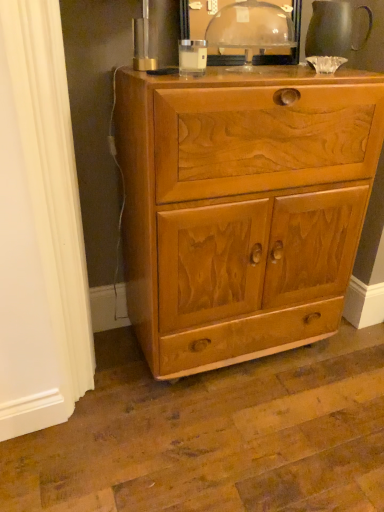
The image size is (384, 512). What do you see at coordinates (241, 211) in the screenshot?
I see `light brown wood cabinet at center` at bounding box center [241, 211].

Where is `matte gray pitcher at upper right`? matte gray pitcher at upper right is located at coordinates (333, 28).

Is light brown wood cabinet at center looking in the opposite direction of transparent plastic dome at upper center?

No, light brown wood cabinet at center is not facing the opposite direction of transparent plastic dome at upper center.

From a real-world perspective, is light brown wood cabinet at center physically located above or below transparent plastic dome at upper center?

light brown wood cabinet at center is below transparent plastic dome at upper center.

Can you see light brown wood cabinet at center touching transparent plastic dome at upper center?

No, light brown wood cabinet at center is not next to transparent plastic dome at upper center.

From a real-world perspective, is matte gray pitcher at upper right on top of transparent plastic dome at upper center?

Correct, in the physical world, matte gray pitcher at upper right is higher than transparent plastic dome at upper center.

From their relative heights in the image, would you say matte gray pitcher at upper right is taller or shorter than transparent plastic dome at upper center?

In the image, matte gray pitcher at upper right appears to be shorter than transparent plastic dome at upper center.

Is matte gray pitcher at upper right in front of or behind transparent plastic dome at upper center in the image?

matte gray pitcher at upper right is positioned farther from the viewer than transparent plastic dome at upper center.

Is matte gray pitcher at upper right at the left side of transparent plastic dome at upper center?

No.

Are transparent plastic dome at upper center and matte gray pitcher at upper right located far from each other?

No.

Considering the relative sizes of transparent plastic dome at upper center and matte gray pitcher at upper right in the image provided, is transparent plastic dome at upper center thinner than matte gray pitcher at upper right?

Incorrect, the width of transparent plastic dome at upper center is not less than that of matte gray pitcher at upper right.

From a real-world perspective, between transparent plastic dome at upper center and matte gray pitcher at upper right, who is vertically lower?

From a 3D spatial view, transparent plastic dome at upper center is below.

Can you tell me how much transparent plastic dome at upper center and matte gray pitcher at upper right differ in facing direction?

The facing directions of transparent plastic dome at upper center and matte gray pitcher at upper right are 2.58 degrees apart.

Can you confirm if matte gray pitcher at upper right is positioned to the right of light brown wood cabinet at center?

Yes, matte gray pitcher at upper right is to the right of light brown wood cabinet at center.

Is matte gray pitcher at upper right oriented towards light brown wood cabinet at center?

No, matte gray pitcher at upper right is not oriented towards light brown wood cabinet at center.

Considering the positions of objects matte gray pitcher at upper right and light brown wood cabinet at center in the image provided, who is behind, matte gray pitcher at upper right or light brown wood cabinet at center?

matte gray pitcher at upper right is behind.

Relative to matte gray pitcher at upper right, is light brown wood cabinet at center in front or behind?

light brown wood cabinet at center is positioned closer to the viewer than matte gray pitcher at upper right.

From a real-world perspective, between light brown wood cabinet at center and matte gray pitcher at upper right, who is vertically higher?

From a 3D spatial view, matte gray pitcher at upper right is above.

How many degrees apart are the facing directions of light brown wood cabinet at center and matte gray pitcher at upper right?

1.82 degrees.

Could you tell me if light brown wood cabinet at center is turned towards matte gray pitcher at upper right?

No, light brown wood cabinet at center is not turned towards matte gray pitcher at upper right.

From the image's perspective, is transparent plastic dome at upper center over light brown wood cabinet at center?

Yes.

Is light brown wood cabinet at center surrounded by transparent plastic dome at upper center?

Actually, light brown wood cabinet at center is outside transparent plastic dome at upper center.

Is transparent plastic dome at upper center aimed at light brown wood cabinet at center?

No, transparent plastic dome at upper center is not facing towards light brown wood cabinet at center.

Can you confirm if transparent plastic dome at upper center is shorter than light brown wood cabinet at center?

Yes, transparent plastic dome at upper center is shorter than light brown wood cabinet at center.

Image resolution: width=384 pixels, height=512 pixels. Identify the location of chest of drawers below the transparent plastic dome at upper center (from a real-world perspective). (241, 211).

Find the location of a particular element. The image size is (384, 512). table lamp that is below the matte gray pitcher at upper right (from the image's perspective) is located at coordinates (253, 34).

Based on their spatial positions, is transparent plastic dome at upper center or light brown wood cabinet at center further from matte gray pitcher at upper right?

The object further to matte gray pitcher at upper right is light brown wood cabinet at center.

In the scene shown: Estimate the real-world distances between objects in this image. Which object is closer to light brown wood cabinet at center, matte gray pitcher at upper right or transparent plastic dome at upper center?

transparent plastic dome at upper center lies closer to light brown wood cabinet at center than the other object.

Considering their positions, is light brown wood cabinet at center positioned further to matte gray pitcher at upper right than transparent plastic dome at upper center?

light brown wood cabinet at center is positioned further to the anchor matte gray pitcher at upper right.

Considering their positions, is matte gray pitcher at upper right positioned closer to transparent plastic dome at upper center than light brown wood cabinet at center?

matte gray pitcher at upper right is positioned closer to the anchor transparent plastic dome at upper center.

In the scene shown: Based on their spatial positions, is light brown wood cabinet at center or matte gray pitcher at upper right further from transparent plastic dome at upper center?

The object further to transparent plastic dome at upper center is light brown wood cabinet at center.

Looking at this image, looking at the image, which one is located further to light brown wood cabinet at center, transparent plastic dome at upper center or matte gray pitcher at upper right?

matte gray pitcher at upper right.

Find the location of a particular element. This screenshot has height=512, width=384. table lamp between matte gray pitcher at upper right and light brown wood cabinet at center vertically is located at coordinates (253, 34).